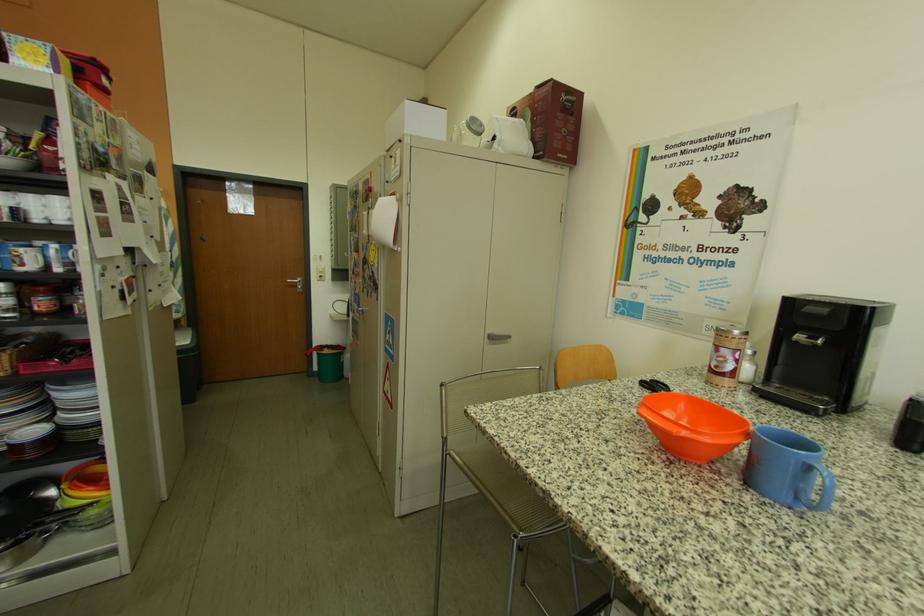
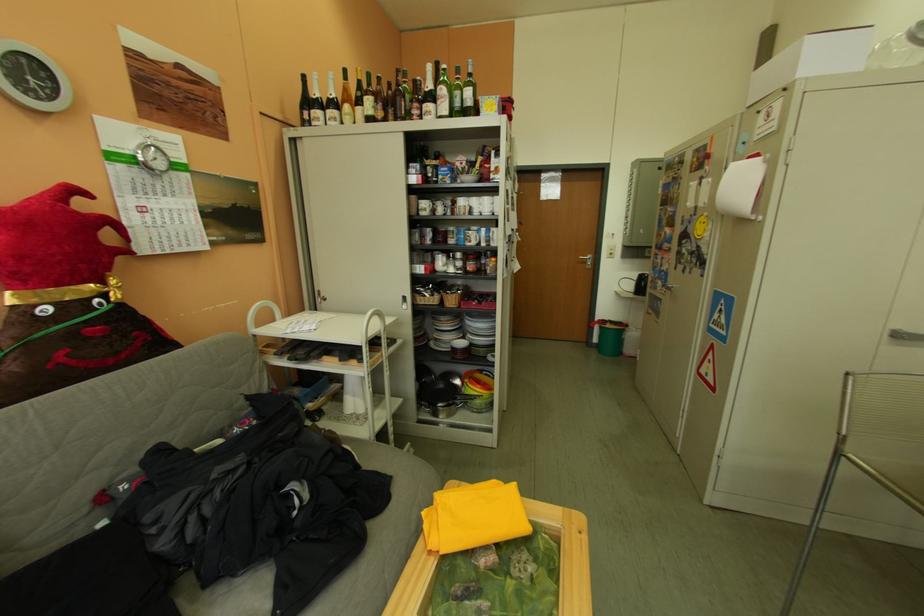
In the second image, find the point that corresponds to [335,353] in the first image.

(617, 326)